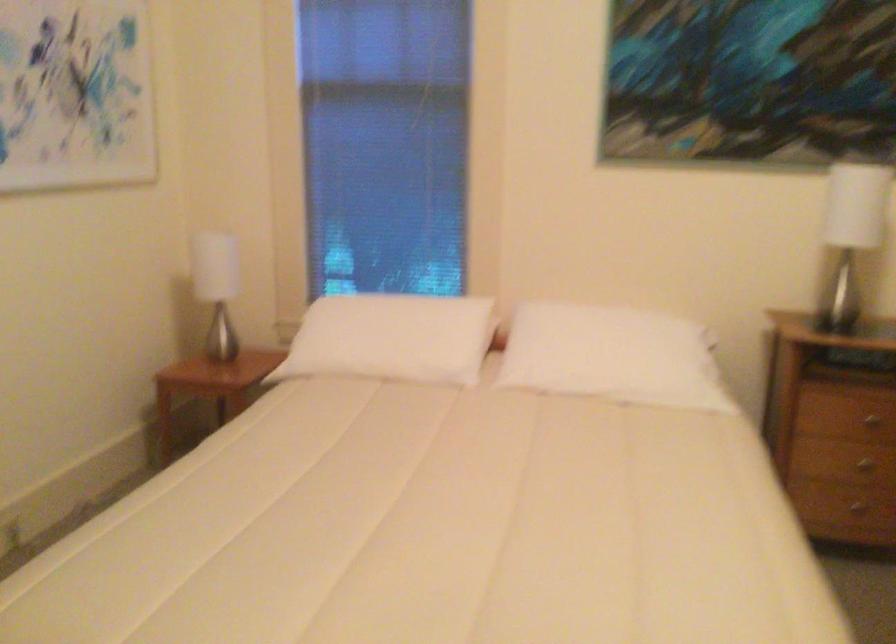
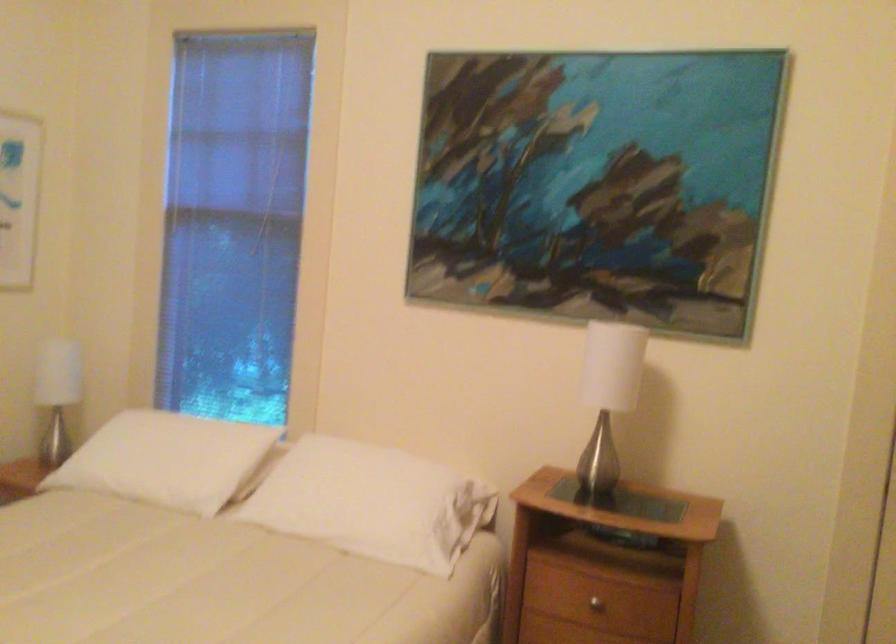
Locate, in the second image, the point that corresponds to point 642,353 in the first image.

(373, 502)